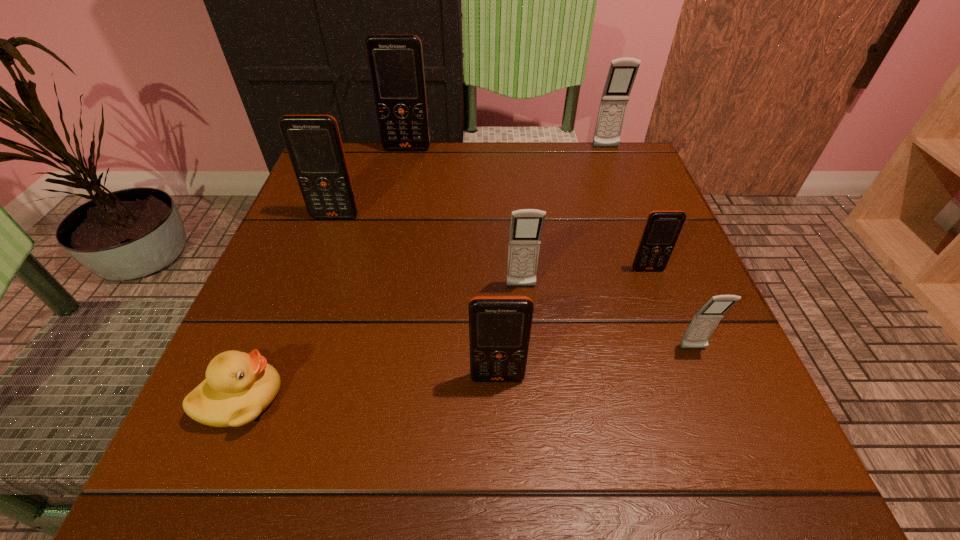
Image resolution: width=960 pixels, height=540 pixels. In order to click on the tallest object in this screenshot , I will do `click(395, 62)`.

This screenshot has height=540, width=960. Find the location of `the farthest orange cellular telephone`. the farthest orange cellular telephone is located at coordinates (395, 62).

Where is `the biggest gray cellular telephone`? Image resolution: width=960 pixels, height=540 pixels. the biggest gray cellular telephone is located at coordinates (622, 72).

This screenshot has width=960, height=540. In order to click on the leftmost cellular telephone in this screenshot , I will do `click(313, 142)`.

Locate an element on the screen. the second biggest orange cellular telephone is located at coordinates (313, 142).

Where is `the fifth farthest cellular telephone`? The width and height of the screenshot is (960, 540). the fifth farthest cellular telephone is located at coordinates (526, 227).

Where is `the second biggest gray cellular telephone`? This screenshot has width=960, height=540. the second biggest gray cellular telephone is located at coordinates (526, 227).

The image size is (960, 540). Find the location of `the second smallest orange cellular telephone`. the second smallest orange cellular telephone is located at coordinates (499, 326).

You are a GUI agent. You are given a task and a screenshot of the screen. Output one action in this format:
    pyautogui.click(x=<x>, y=<y>)
    Task: Click on the second orange cellular telephone from right to left
    The height and width of the screenshot is (540, 960).
    Given the screenshot: What is the action you would take?
    pyautogui.click(x=499, y=326)

Image resolution: width=960 pixels, height=540 pixels. In order to click on the fourth farthest cellular telephone in this screenshot , I will do `click(662, 228)`.